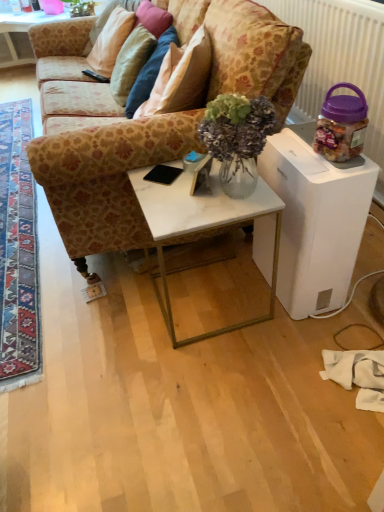
This screenshot has height=512, width=384. Identify the location of vacant area that is in front of black matte mobile phone at center. (172, 200).